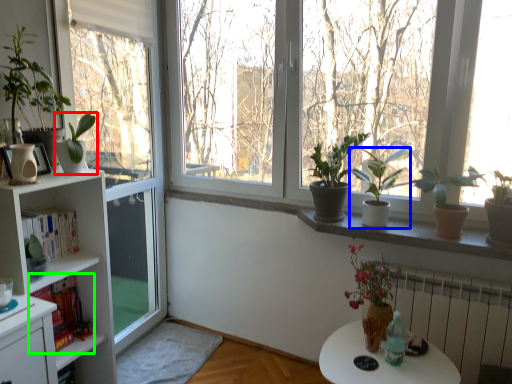
Question: Based on their relative distances, which object is farther from houseplant (highlighted by a red box)? Choose from houseplant (highlighted by a blue box) and book (highlighted by a green box).

Choices:
 (A) houseplant
 (B) book

Answer: (A)